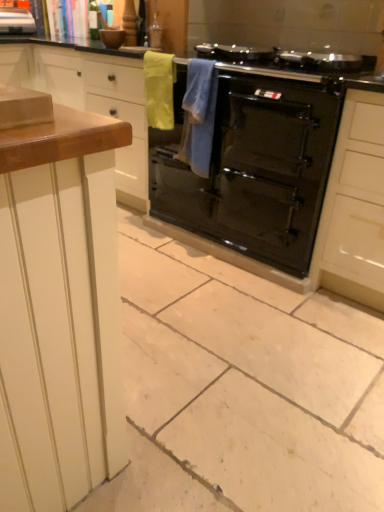
Question: Is metallic silver toaster at upper left spatially inside black glossy oven at center, or outside of it?

Choices:
 (A) outside
 (B) inside

Answer: (A)

Question: In the image, is metallic silver toaster at upper left on the left side or the right side of black glossy oven at center?

Choices:
 (A) right
 (B) left

Answer: (B)

Question: Which of these objects is positioned closest to the metallic silver toaster at upper left?

Choices:
 (A) black glossy oven at center
 (B) wooden countertop at left
 (C) yellow fabric towel at upper center, the first material positioned from the left
 (D) blue towel at center, arranged as the 1th material when viewed from the right

Answer: (B)

Question: Estimate the real-world distances between objects in this image. Which object is closer to the black glossy oven at center?

Choices:
 (A) blue towel at center, arranged as the 1th material when viewed from the right
 (B) yellow fabric towel at upper center, the second material positioned from the right
 (C) metallic silver toaster at upper left
 (D) wooden countertop at left

Answer: (A)